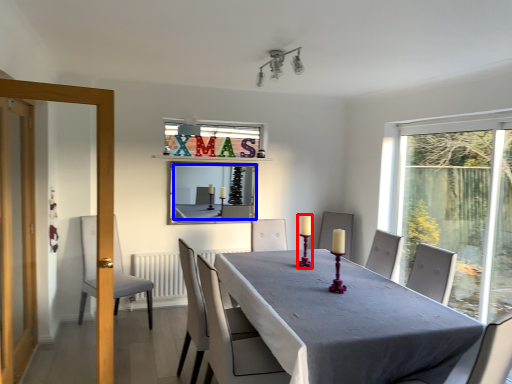
Question: Among these objects, which one is farthest to the camera, candle holder (highlighted by a red box) or mirror (highlighted by a blue box)?

Choices:
 (A) candle holder
 (B) mirror

Answer: (B)